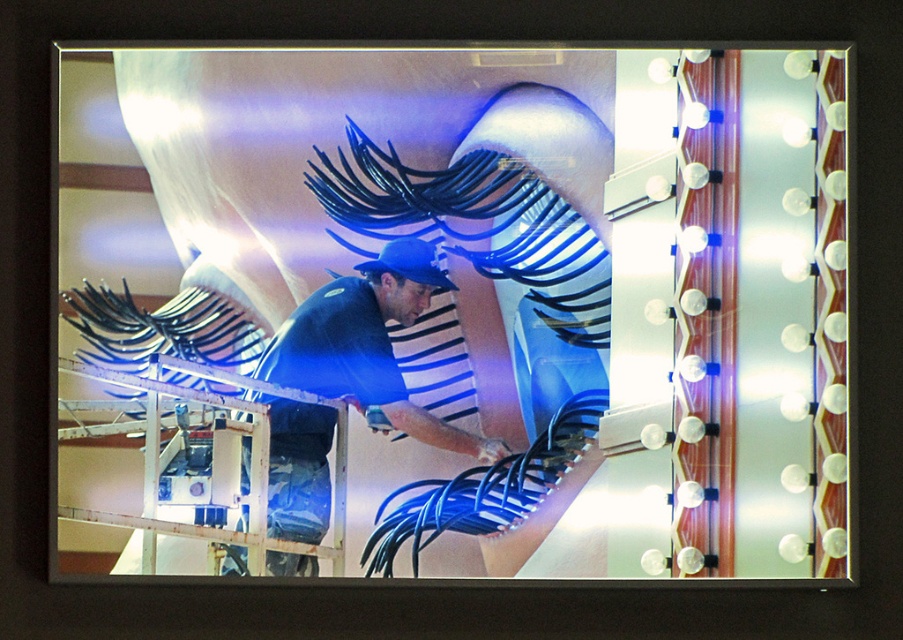
Who is taller, metallic silver mirror at center or blue matte shirt at center?

metallic silver mirror at center is taller.

Image resolution: width=903 pixels, height=640 pixels. I want to click on metallic silver mirror at center, so click(455, 308).

In order to click on metallic silver mirror at center in this screenshot , I will do `click(455, 308)`.